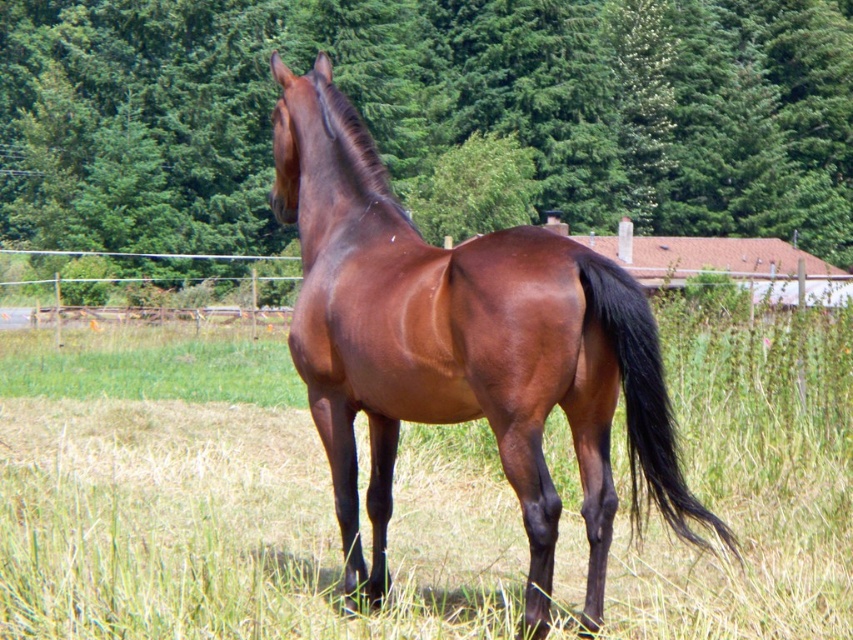
Question: Estimate the real-world distances between objects in this image. Which object is closer to the shiny brown horse at center?

Choices:
 (A) brown glossy tail at center-right
 (B) green leafy tree at upper center

Answer: (A)

Question: Which object is the farthest from the green leafy tree at upper center?

Choices:
 (A) brown glossy tail at center-right
 (B) shiny brown horse at center

Answer: (B)

Question: From the image, what is the correct spatial relationship of shiny brown horse at center in relation to brown glossy tail at center-right?

Choices:
 (A) below
 (B) above

Answer: (B)

Question: Is green leafy tree at upper center thinner than brown glossy tail at center-right?

Choices:
 (A) no
 (B) yes

Answer: (A)

Question: Which point is closer to the camera?

Choices:
 (A) (672, 444)
 (B) (45, 3)

Answer: (A)

Question: Does shiny brown horse at center lie in front of brown glossy tail at center-right?

Choices:
 (A) no
 (B) yes

Answer: (A)